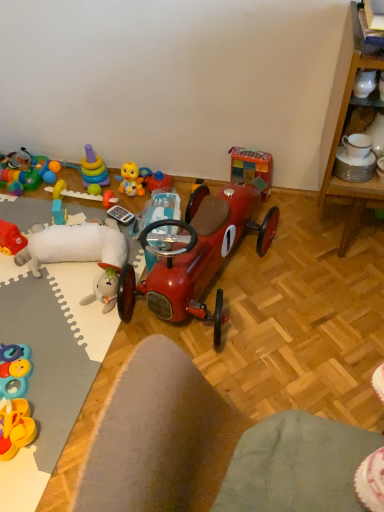
Identify the location of free space behind matte plastic desk at center. The width and height of the screenshot is (384, 512). (289, 381).